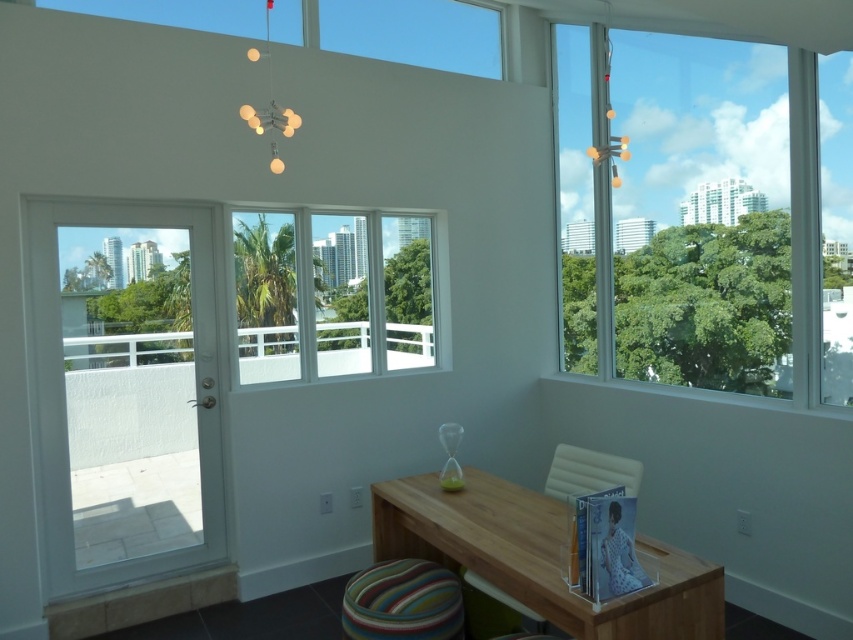
You are moving a large piece of furniture that is 1.2 meters wide. You need to pass through the white glass door at left and the striped fabric stool at lower center. Which one can the furniture fit through based on their widths?

The white glass door at left has a larger width than the striped fabric stool at lower center, so the furniture can fit through the white glass door at left but not the striped fabric stool at lower center.

You are standing in the room and want to exit through the door. Based on your position, where should you walk to reach the white glass door at left?

The white glass door at left is located at point (125, 392), so you should walk towards the coordinates (125, 392) to reach it.